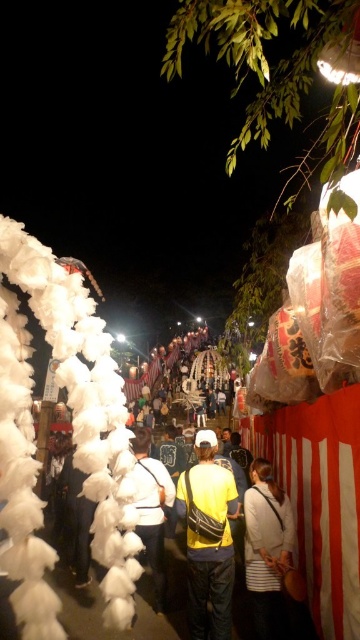
Is white fluffy cotton at left shorter than yellow fabric bag at center?

In fact, white fluffy cotton at left may be taller than yellow fabric bag at center.

Measure the distance between white fluffy cotton at left and camera.

2.21 meters

Is point (24, 340) farther from camera compared to point (199, 449)?

No, (24, 340) is in front of (199, 449).

I want to click on white fluffy cotton at left, so click(84, 406).

Is yellow fabric bag at center taller than yellow fabric shirt at center?

No.

Is yellow fabric bag at center smaller than yellow fabric shirt at center?

Correct, yellow fabric bag at center occupies less space than yellow fabric shirt at center.

Which is in front, point (199, 445) or point (149, 534)?

Point (199, 445) is in front.

The height and width of the screenshot is (640, 360). I want to click on yellow fabric bag at center, so click(x=209, y=540).

Can you confirm if white fluffy cotton at left is shorter than yellow fabric shirt at center?

In fact, white fluffy cotton at left may be taller than yellow fabric shirt at center.

Where is `white fluffy cotton at left`? This screenshot has height=640, width=360. white fluffy cotton at left is located at coordinates (84, 406).

Between point (106, 394) and point (141, 444), which one is positioned behind?

The point (141, 444) is more distant.

You are a GUI agent. You are given a task and a screenshot of the screen. Output one action in this format:
    pyautogui.click(x=<x>, y=<y>)
    Task: Click on the white fluffy cotton at left
    This screenshot has width=360, height=640.
    Given the screenshot: What is the action you would take?
    click(x=84, y=406)